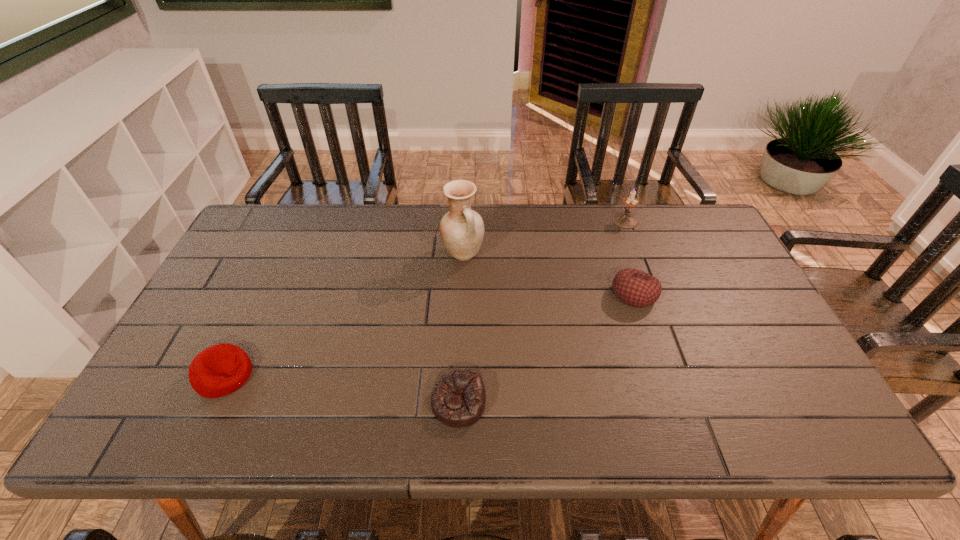
Locate an element on the screen. blank space that satisfies the following two spatial constraints: 1. on the seat area of the leftmost object; 2. on the back side of the shortest beanbag is located at coordinates (211, 403).